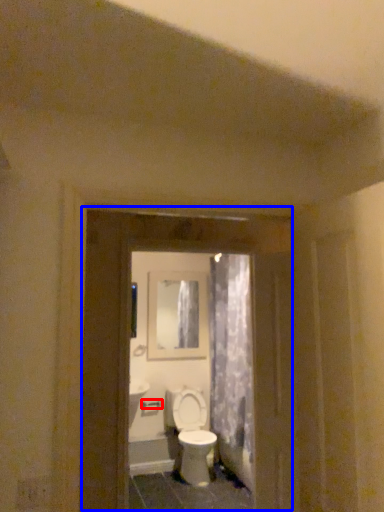
Question: Among these objects, which one is farthest to the camera, door handle (highlighted by a red box) or screen door (highlighted by a blue box)?

Choices:
 (A) door handle
 (B) screen door

Answer: (A)